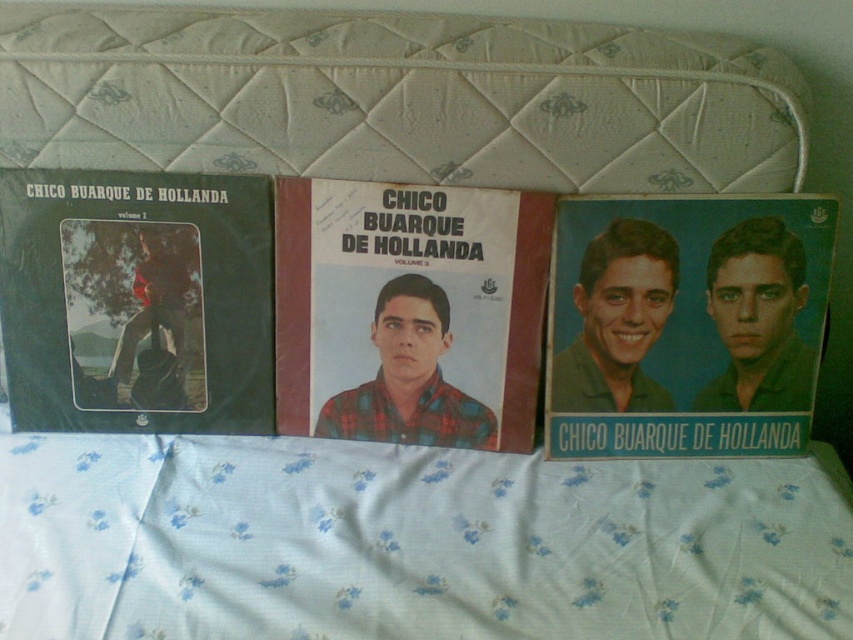
Consider the image. You are looking at the leftmost album. What is the position of the white fabric at upper center relative to the green matte vinyl record at left?

The white fabric at upper center is located below the green matte vinyl record at left.

You are looking at the leftmost album of the three vinyl records on the bed. There are two points marked on its cover. One is at coordinate point (297,604) and the other is at point (280,248). Which of these two points is closer to you?

Point (297,604) is closer to you than point (280,248).

What object is located at the coordinates point (686, 324)?

The blue matte poster at center is located at point (686, 324).